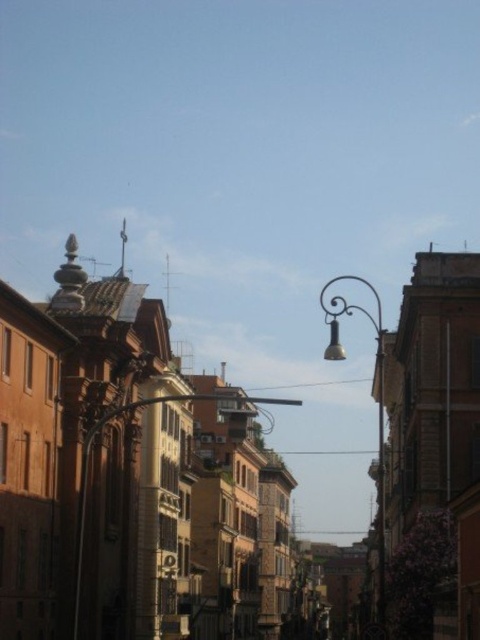
Is metallic curved street light at upper center closer to the viewer compared to metallic streetlight at center?

Yes, it is in front of metallic streetlight at center.

Can you confirm if metallic curved street light at upper center is shorter than metallic streetlight at center?

In fact, metallic curved street light at upper center may be taller than metallic streetlight at center.

Which is behind, point (379, 432) or point (164, 401)?

The point (379, 432) is more distant.

Identify the location of metallic curved street light at upper center. (376, 401).